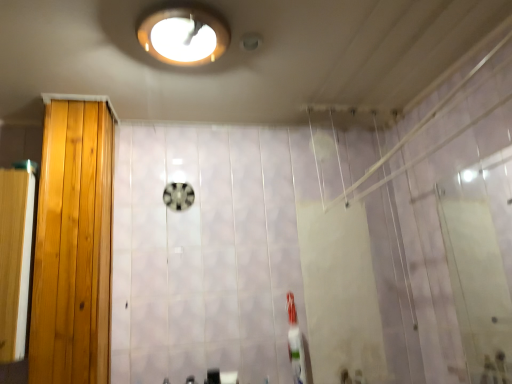
This screenshot has width=512, height=384. Describe the element at coordinates (478, 268) in the screenshot. I see `transparent glass screen door at right, the second screen door viewed from the left` at that location.

The width and height of the screenshot is (512, 384). What do you see at coordinates (73, 246) in the screenshot? I see `light brown wood door at left` at bounding box center [73, 246].

Measure the distance between point (x=76, y=182) and camera.

A distance of 1.66 meters exists between point (x=76, y=182) and camera.

Find the location of a particular element. This screenshot has height=384, width=512. wooden screen door at left, arranged as the first screen door when viewed from the left is located at coordinates (15, 258).

Is matte white light fixture at upper center aimed at light brown wood door at left?

No, matte white light fixture at upper center is not oriented towards light brown wood door at left.

Which of these two, matte white light fixture at upper center or light brown wood door at left, is wider?

Wider between the two is matte white light fixture at upper center.

Is matte white light fixture at upper center to the left or to the right of light brown wood door at left in the image?

Clearly, matte white light fixture at upper center is on the right of light brown wood door at left in the image.

From a real-world perspective, is matte white light fixture at upper center on top of light brown wood door at left?

Yes.

Is light brown wood door at left turned away from transparent glass screen door at right, the 1th screen door from the right?

light brown wood door at left is not turned away from transparent glass screen door at right, the 1th screen door from the right.

Looking at this image, is light brown wood door at left positioned far away from transparent glass screen door at right, the second screen door viewed from the left?

That's right, there is a large distance between light brown wood door at left and transparent glass screen door at right, the second screen door viewed from the left.

In the image, is light brown wood door at left positioned in front of or behind transparent glass screen door at right, the 1th screen door from the right?

Clearly, light brown wood door at left is behind transparent glass screen door at right, the 1th screen door from the right.

Does light brown wood door at left appear on the right side of transparent glass screen door at right, the 1th screen door from the right?

In fact, light brown wood door at left is to the left of transparent glass screen door at right, the 1th screen door from the right.

Is transparent glass screen door at right, the 1th screen door from the right, directly adjacent to wooden screen door at left, arranged as the first screen door when viewed from the left?

No, transparent glass screen door at right, the 1th screen door from the right, is not making contact with wooden screen door at left, arranged as the first screen door when viewed from the left.

This screenshot has height=384, width=512. In order to click on screen door below the wooden screen door at left, which ranks as the second screen door in right-to-left order (from the image's perspective) in this screenshot , I will do `click(478, 268)`.

In the image, is transparent glass screen door at right, the 1th screen door from the right, positioned in front of or behind wooden screen door at left, arranged as the first screen door when viewed from the left?

Clearly, transparent glass screen door at right, the 1th screen door from the right, is in front of wooden screen door at left, arranged as the first screen door when viewed from the left.

From a real-world perspective, which is physically above, transparent glass screen door at right, the second screen door viewed from the left, or wooden screen door at left, which ranks as the second screen door in right-to-left order?

wooden screen door at left, which ranks as the second screen door in right-to-left order, is physically above.

I want to click on light fixture that is in front of the wooden screen door at left, arranged as the first screen door when viewed from the left, so click(183, 33).

Considering the sizes of matte white light fixture at upper center and wooden screen door at left, which ranks as the second screen door in right-to-left order, in the image, is matte white light fixture at upper center taller or shorter than wooden screen door at left, which ranks as the second screen door in right-to-left order,?

Clearly, matte white light fixture at upper center is shorter compared to wooden screen door at left, which ranks as the second screen door in right-to-left order.

Considering the positions of objects matte white light fixture at upper center and wooden screen door at left, which ranks as the second screen door in right-to-left order, in the image provided, who is more to the left, matte white light fixture at upper center or wooden screen door at left, which ranks as the second screen door in right-to-left order,?

wooden screen door at left, which ranks as the second screen door in right-to-left order.

From the image's perspective, is matte white light fixture at upper center positioned above or below wooden screen door at left, which ranks as the second screen door in right-to-left order?

From the image's perspective, matte white light fixture at upper center appears above wooden screen door at left, which ranks as the second screen door in right-to-left order.

Is transparent glass screen door at right, the second screen door viewed from the left, further to the viewer compared to matte white light fixture at upper center?

Yes, it is behind matte white light fixture at upper center.

From a real-world perspective, is transparent glass screen door at right, the 1th screen door from the right, physically above matte white light fixture at upper center?

No, from a real-world perspective, transparent glass screen door at right, the 1th screen door from the right, is not above matte white light fixture at upper center.

Who is shorter, transparent glass screen door at right, the 1th screen door from the right, or matte white light fixture at upper center?

matte white light fixture at upper center.

Consider the image. Which is correct: transparent glass screen door at right, the 1th screen door from the right, is inside matte white light fixture at upper center, or outside of it?

transparent glass screen door at right, the 1th screen door from the right, lies outside matte white light fixture at upper center.

Is light brown wood door at left at the back of wooden screen door at left, which ranks as the second screen door in right-to-left order?

No, light brown wood door at left is not at the back of wooden screen door at left, which ranks as the second screen door in right-to-left order.

Would you consider wooden screen door at left, which ranks as the second screen door in right-to-left order, to be distant from light brown wood door at left?

No, wooden screen door at left, which ranks as the second screen door in right-to-left order, is not far away from light brown wood door at left.

From the image's perspective, is wooden screen door at left, which ranks as the second screen door in right-to-left order, beneath light brown wood door at left?

Indeed, from the image's perspective, wooden screen door at left, which ranks as the second screen door in right-to-left order, is shown beneath light brown wood door at left.

Is wooden screen door at left, which ranks as the second screen door in right-to-left order, wider or thinner than light brown wood door at left?

Clearly, wooden screen door at left, which ranks as the second screen door in right-to-left order, has more width compared to light brown wood door at left.

Would you say wooden screen door at left, which ranks as the second screen door in right-to-left order, is inside or outside matte white light fixture at upper center?

wooden screen door at left, which ranks as the second screen door in right-to-left order, lies outside matte white light fixture at upper center.

Consider the image. Which object is closer to the camera, wooden screen door at left, arranged as the first screen door when viewed from the left, or matte white light fixture at upper center?

matte white light fixture at upper center is more forward.

From their relative heights in the image, would you say wooden screen door at left, which ranks as the second screen door in right-to-left order, is taller or shorter than matte white light fixture at upper center?

Considering their sizes, wooden screen door at left, which ranks as the second screen door in right-to-left order, has more height than matte white light fixture at upper center.

Consider the image. Is wooden screen door at left, which ranks as the second screen door in right-to-left order, positioned far away from matte white light fixture at upper center?

wooden screen door at left, which ranks as the second screen door in right-to-left order, is near matte white light fixture at upper center, not far away.

The image size is (512, 384). Find the location of `door on the left side of matte white light fixture at upper center`. door on the left side of matte white light fixture at upper center is located at coordinates (73, 246).

This screenshot has height=384, width=512. Find the location of `door that is above the transparent glass screen door at right, the second screen door viewed from the left (from the image's perspective)`. door that is above the transparent glass screen door at right, the second screen door viewed from the left (from the image's perspective) is located at coordinates (73, 246).

Considering their positions, is wooden screen door at left, which ranks as the second screen door in right-to-left order, positioned closer to light brown wood door at left than transparent glass screen door at right, the second screen door viewed from the left?

The object closer to light brown wood door at left is wooden screen door at left, which ranks as the second screen door in right-to-left order.

From the image, which object appears to be nearer to transparent glass screen door at right, the 1th screen door from the right, light brown wood door at left or matte white light fixture at upper center?

The object closer to transparent glass screen door at right, the 1th screen door from the right, is matte white light fixture at upper center.

Based on their spatial positions, is matte white light fixture at upper center or light brown wood door at left further from wooden screen door at left, which ranks as the second screen door in right-to-left order?

Among the two, matte white light fixture at upper center is located further to wooden screen door at left, which ranks as the second screen door in right-to-left order.

When comparing their distances from transparent glass screen door at right, the second screen door viewed from the left, does wooden screen door at left, which ranks as the second screen door in right-to-left order, or matte white light fixture at upper center seem closer?

Among the two, matte white light fixture at upper center is located nearer to transparent glass screen door at right, the second screen door viewed from the left.

When comparing their distances from wooden screen door at left, arranged as the first screen door when viewed from the left, does light brown wood door at left or matte white light fixture at upper center seem closer?

light brown wood door at left is positioned closer to the anchor wooden screen door at left, arranged as the first screen door when viewed from the left.

Estimate the real-world distances between objects in this image. Which object is further from matte white light fixture at upper center, wooden screen door at left, arranged as the first screen door when viewed from the left, or light brown wood door at left?

Among the two, wooden screen door at left, arranged as the first screen door when viewed from the left, is located further to matte white light fixture at upper center.

Based on their spatial positions, is transparent glass screen door at right, the second screen door viewed from the left, or wooden screen door at left, arranged as the first screen door when viewed from the left, further from light brown wood door at left?

transparent glass screen door at right, the second screen door viewed from the left, is positioned further to the anchor light brown wood door at left.

Considering their positions, is matte white light fixture at upper center positioned closer to light brown wood door at left than wooden screen door at left, which ranks as the second screen door in right-to-left order?

Based on the image, wooden screen door at left, which ranks as the second screen door in right-to-left order, appears to be nearer to light brown wood door at left.

This screenshot has width=512, height=384. Find the location of `light fixture situated between wooden screen door at left, arranged as the first screen door when viewed from the left, and transparent glass screen door at right, the second screen door viewed from the left, from left to right`. light fixture situated between wooden screen door at left, arranged as the first screen door when viewed from the left, and transparent glass screen door at right, the second screen door viewed from the left, from left to right is located at coordinates (183, 33).

Find the location of `door located between wooden screen door at left, which ranks as the second screen door in right-to-left order, and transparent glass screen door at right, the second screen door viewed from the left, in the left-right direction`. door located between wooden screen door at left, which ranks as the second screen door in right-to-left order, and transparent glass screen door at right, the second screen door viewed from the left, in the left-right direction is located at coordinates (73, 246).

You are a GUI agent. You are given a task and a screenshot of the screen. Output one action in this format:
    pyautogui.click(x=<x>, y=<y>)
    Task: Click on the door between matte white light fixture at upper center and wooden screen door at left, arranged as the first screen door when viewed from the left, in the up-down direction
    The height and width of the screenshot is (384, 512).
    Given the screenshot: What is the action you would take?
    pyautogui.click(x=73, y=246)

Where is `light fixture between light brown wood door at left and transparent glass screen door at right, the 1th screen door from the right, in the horizontal direction`? The image size is (512, 384). light fixture between light brown wood door at left and transparent glass screen door at right, the 1th screen door from the right, in the horizontal direction is located at coordinates (183, 33).